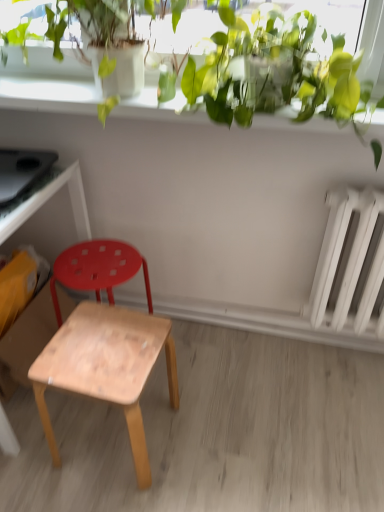
Question: Considering the relative positions of green leafy plant at upper center and natural wood stool at center, which is the first stool in front-to-back order, in the image provided, is green leafy plant at upper center to the left of natural wood stool at center, which is the first stool in front-to-back order, from the viewer's perspective?

Choices:
 (A) no
 (B) yes

Answer: (A)

Question: From a real-world perspective, is green leafy plant at upper center beneath natural wood stool at center, which is the first stool in front-to-back order?

Choices:
 (A) yes
 (B) no

Answer: (B)

Question: Can you confirm if green leafy plant at upper center is taller than natural wood stool at center, which is the second stool in back-to-front order?

Choices:
 (A) no
 (B) yes

Answer: (A)

Question: Is green leafy plant at upper center facing away from natural wood stool at center, which is the second stool in back-to-front order?

Choices:
 (A) no
 (B) yes

Answer: (A)

Question: Does green leafy plant at upper center come in front of natural wood stool at center, which is the second stool in back-to-front order?

Choices:
 (A) no
 (B) yes

Answer: (B)

Question: From a real-world perspective, is wooden desk at left above or below natural wood stool at center, which is the first stool in front-to-back order?

Choices:
 (A) above
 (B) below

Answer: (A)

Question: From their relative heights in the image, would you say wooden desk at left is taller or shorter than natural wood stool at center, which is the first stool in front-to-back order?

Choices:
 (A) short
 (B) tall

Answer: (B)

Question: Which is correct: wooden desk at left is inside natural wood stool at center, which is the first stool in front-to-back order, or outside of it?

Choices:
 (A) inside
 (B) outside

Answer: (B)

Question: Looking at their shapes, would you say wooden desk at left is wider or thinner than natural wood stool at center, which is the second stool in back-to-front order?

Choices:
 (A) wide
 (B) thin

Answer: (A)

Question: Looking at their shapes, would you say white matte radiator at right is wider or thinner than wooden stool at lower left, marked as the 1th stool in a back-to-front arrangement?

Choices:
 (A) wide
 (B) thin

Answer: (B)

Question: Visually, is white matte radiator at right positioned to the left or to the right of wooden stool at lower left, marked as the 1th stool in a back-to-front arrangement?

Choices:
 (A) right
 (B) left

Answer: (A)

Question: Considering the positions of point (321, 280) and point (56, 315), is point (321, 280) closer or farther from the camera than point (56, 315)?

Choices:
 (A) farther
 (B) closer

Answer: (B)

Question: From a real-world perspective, is white matte radiator at right positioned above or below wooden stool at lower left, the 2th stool viewed from the front?

Choices:
 (A) below
 (B) above

Answer: (B)

Question: Is white matte radiator at right to the left or to the right of green leafy plant at upper center in the image?

Choices:
 (A) left
 (B) right

Answer: (B)

Question: Considering the positions of white matte radiator at right and green leafy plant at upper center in the image, is white matte radiator at right bigger or smaller than green leafy plant at upper center?

Choices:
 (A) big
 (B) small

Answer: (B)